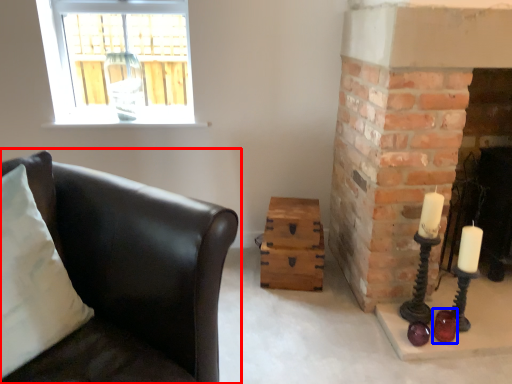
Question: Which point is closer to the camera, studio couch (highlighted by a red box) or candle holder (highlighted by a blue box)?

Choices:
 (A) studio couch
 (B) candle holder

Answer: (A)